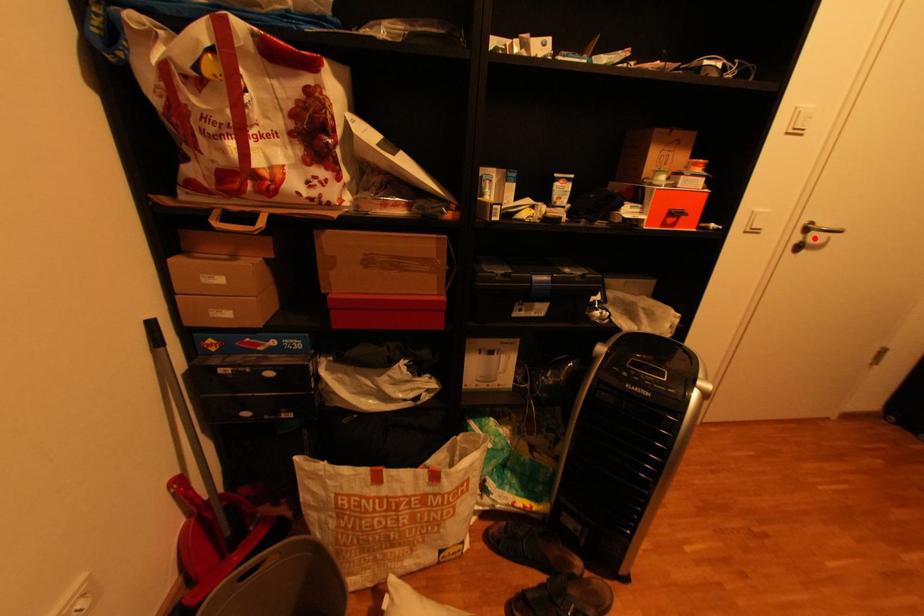
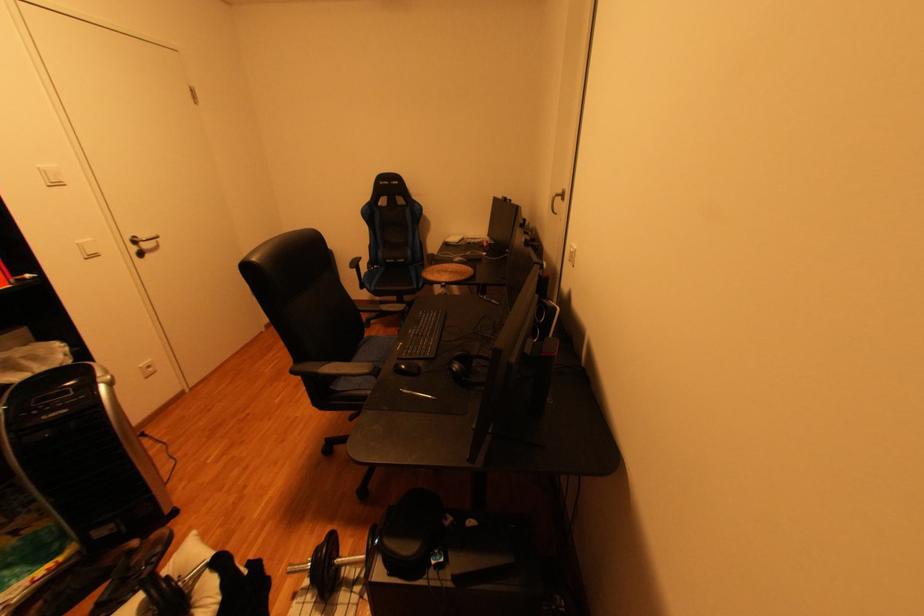
Locate, in the second image, the point that corresponds to the highlighted location in the first image.

(150, 248)